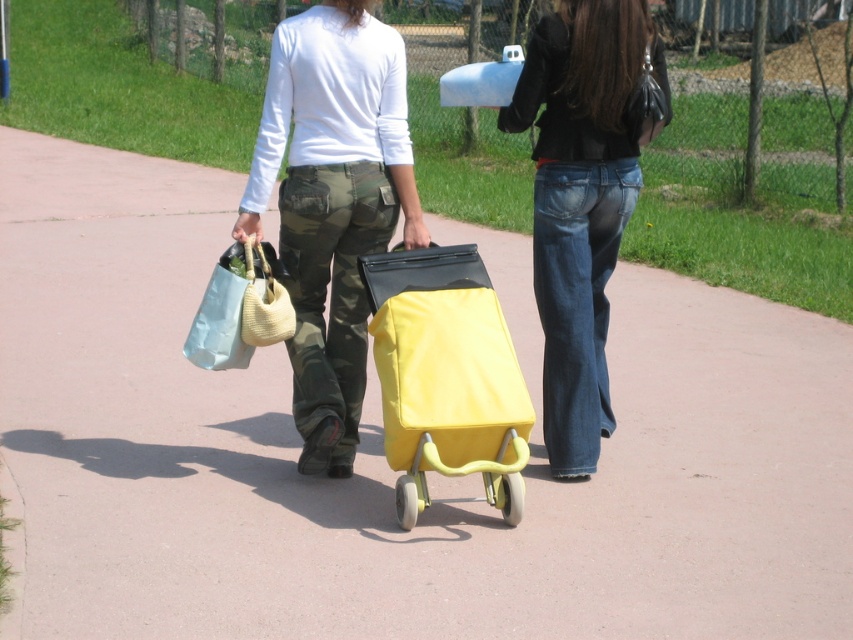
Which is behind, point (347, 285) or point (463, 428)?

The point (347, 285) is more distant.

You are a GUI agent. You are given a task and a screenshot of the screen. Output one action in this format:
    pyautogui.click(x=<x>, y=<y>)
    Task: Click on the camo pants at center
    The height and width of the screenshot is (640, 853).
    Given the screenshot: What is the action you would take?
    pyautogui.click(x=332, y=204)

Is denim jeans at center positioned behind yellow matte shopping cart at center?

That is True.

Is denim jeans at center bigger than yellow matte shopping cart at center?

Yes.

Is point (538, 84) closer to camera compared to point (395, 264)?

No, it is not.

You are a GUI agent. You are given a task and a screenshot of the screen. Output one action in this format:
    pyautogui.click(x=<x>, y=<y>)
    Task: Click on the denim jeans at center
    
    Given the screenshot: What is the action you would take?
    pyautogui.click(x=579, y=202)

Who is taller, denim jeans at center or matte fabric bag at center?

denim jeans at center

Between point (598, 438) and point (241, 333), which one is positioned in front?

Point (241, 333)

Identify the location of denim jeans at center. The height and width of the screenshot is (640, 853). (579, 202).